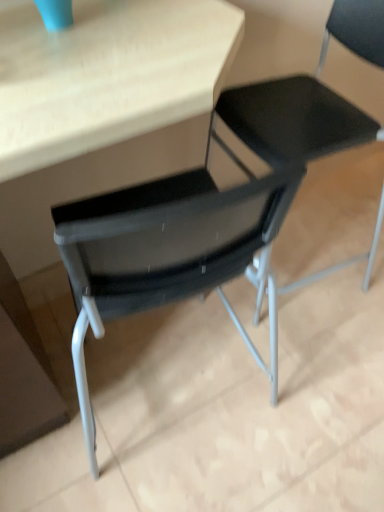
Identify the location of vacant space underneath black mesh chair at center, the second chair in the right-to-left sequence (from a real-world perspective). (297, 265).